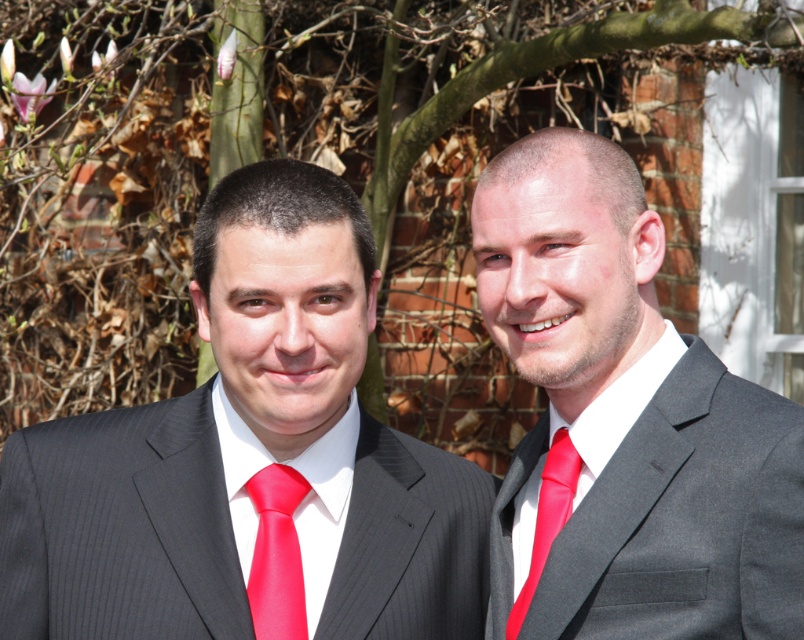
You are a photographer adjusting the camera focus. The matte black suit at left and the red satin tie at center are both in the frame. Which object should you focus on first if you want to ensure the larger one is sharp?

The matte black suit at left is larger in size than the red satin tie at center, so you should focus on the matte black suit at left first to ensure it is sharp.

You are standing in front of the two men in dark pinstripe suits. There is a point at coordinates point (403,636) that you need to reach. Can you walk directly to it without moving the men?

The point (403,636) is 5.20 meters away from viewer, so yes, you can walk directly to it without moving the men because it is at a distance that allows passage around the men.

You are a photographer adjusting your camera settings. You need to focus on the matte black suit at center and the matte red tie at right. Which object should you adjust your focus to first if you want to ensure the closest subject is sharp?

The matte black suit at center is closer to the viewer than the matte red tie at right, so you should focus on the matte black suit at center first to ensure the closest subject is sharp.